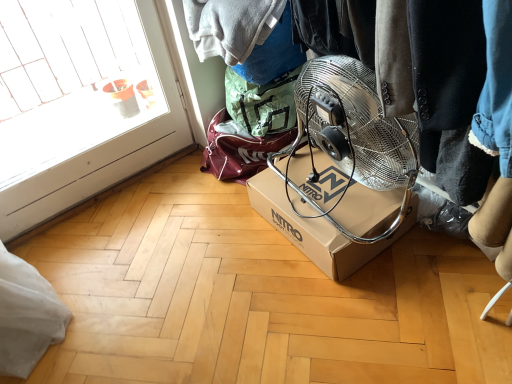
Question: From the image's perspective, is brown cardboard box at center located above or below transparent glass door at left?

Choices:
 (A) below
 (B) above

Answer: (A)

Question: Visually, is brown cardboard box at center positioned to the left or to the right of transparent glass door at left?

Choices:
 (A) left
 (B) right

Answer: (B)

Question: Relative to transparent glass door at left, is brown cardboard box at center in front or behind?

Choices:
 (A) behind
 (B) front

Answer: (A)

Question: Is transparent glass door at left wider or thinner than brown cardboard box at center?

Choices:
 (A) thin
 (B) wide

Answer: (A)

Question: Would you say transparent glass door at left is inside or outside brown cardboard box at center?

Choices:
 (A) inside
 (B) outside

Answer: (B)

Question: From a real-world perspective, is transparent glass door at left above or below brown cardboard box at center?

Choices:
 (A) below
 (B) above

Answer: (B)

Question: Is point (176, 117) closer or farther from the camera than point (291, 165)?

Choices:
 (A) farther
 (B) closer

Answer: (A)